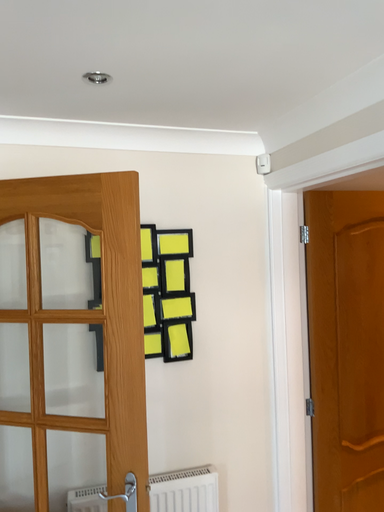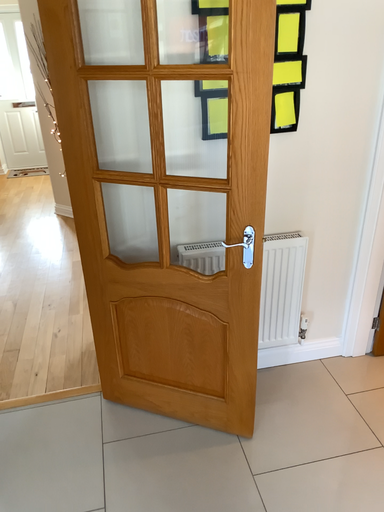
Question: Which way did the camera rotate in the video?

Choices:
 (A) rotated downward
 (B) rotated upward

Answer: (A)